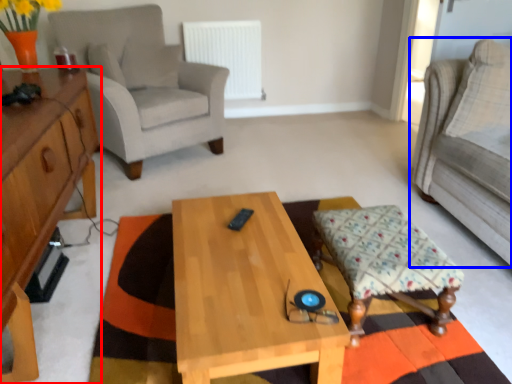
Question: Which of the following is the farthest to the observer, cabinetry (highlighted by a red box) or studio couch (highlighted by a blue box)?

Choices:
 (A) cabinetry
 (B) studio couch

Answer: (B)